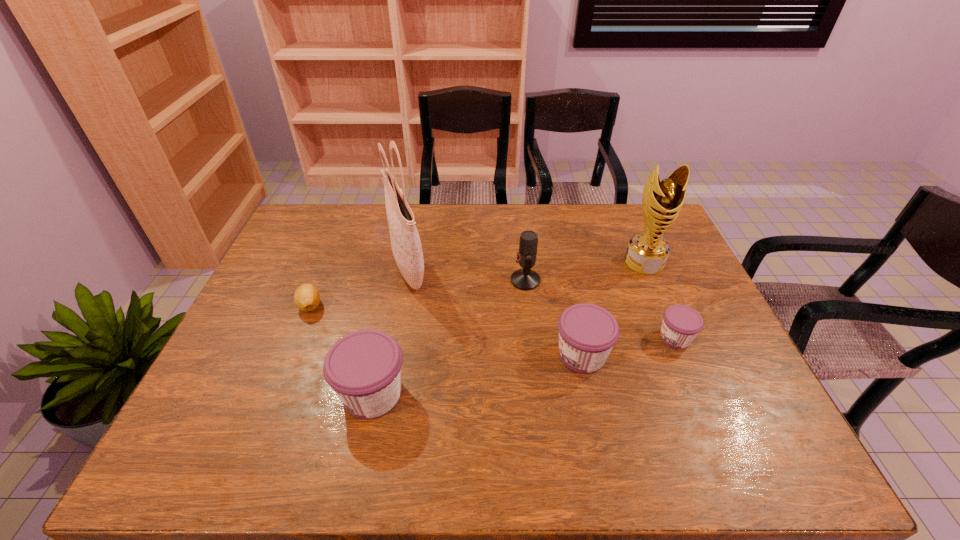
Identify the location of award positioned at the right edge. (647, 252).

This screenshot has width=960, height=540. Find the location of `vacant region at the far edge of the desktop`. vacant region at the far edge of the desktop is located at coordinates (420, 226).

Identify the location of free space at the near edge. This screenshot has width=960, height=540. (598, 409).

This screenshot has width=960, height=540. In order to click on vacant space at the left edge of the desktop in this screenshot , I will do (x=240, y=384).

Locate an element on the screen. free point at the right edge is located at coordinates (674, 296).

You are a GUI agent. You are given a task and a screenshot of the screen. Output one action in this format:
    pyautogui.click(x=<x>, y=<y>)
    Task: Click on the vacant space at the far left corner
    
    Given the screenshot: What is the action you would take?
    pyautogui.click(x=334, y=228)

I want to click on free space at the near right corner, so click(x=765, y=403).

What are the coordinates of `vacant space in between the tallest object and the lemon` in the screenshot? It's located at (359, 288).

Where is `empty space that is in between the second tallest object and the fourth object from right to left`? Image resolution: width=960 pixels, height=540 pixels. empty space that is in between the second tallest object and the fourth object from right to left is located at coordinates (585, 271).

The width and height of the screenshot is (960, 540). Identify the location of vacant area that lies between the leftmost jam and the shopping bag. [x=390, y=332].